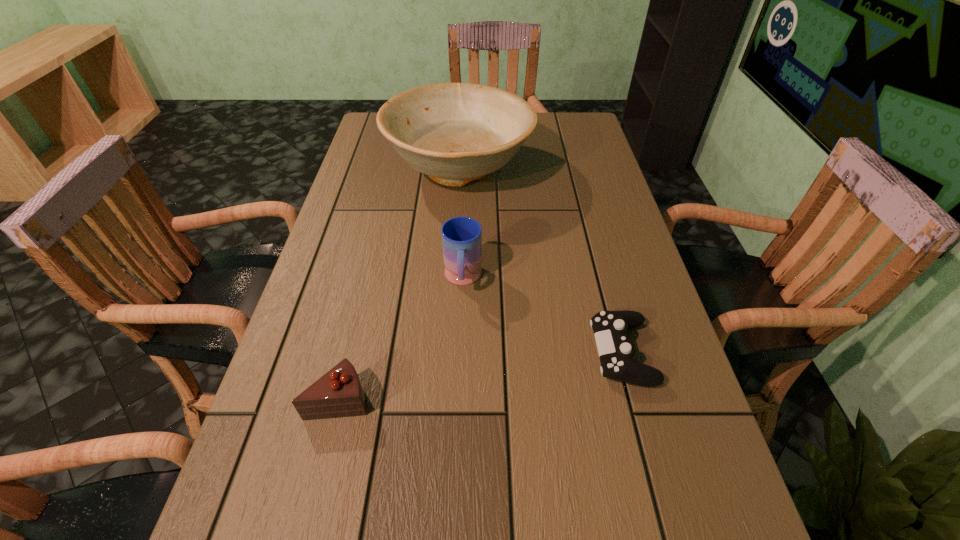
This screenshot has height=540, width=960. Identify the location of free space located 0.220m on the back of the taller chocolate cake. (365, 292).

What are the coordinates of `vacant area located 0.320m on the surface of the second shortest object` in the screenshot? It's located at (432, 353).

Find the location of a particular element. This screenshot has width=960, height=540. free space located on the surface of the second shortest object is located at coordinates (468, 353).

Locate an element on the screen. vacant space located on the surface of the second shortest object is located at coordinates (447, 353).

What are the coordinates of `object located at the far edge` in the screenshot? It's located at (455, 133).

Find the location of a particular element. dish located in the left edge section of the desktop is located at coordinates (455, 133).

What are the coordinates of `chocolate cake at the left edge` in the screenshot? It's located at (338, 393).

At what (x,y) coordinates should I click in order to perform the action: click on object present at the right edge. Please return your answer as a coordinate pair (x, y). Looking at the image, I should click on (610, 328).

You are a GUI agent. You are given a task and a screenshot of the screen. Output one action in this format:
    pyautogui.click(x=<x>, y=<y>)
    Task: Click on the object situated at the far left corner
    Image resolution: width=960 pixels, height=540 pixels.
    Given the screenshot: What is the action you would take?
    pyautogui.click(x=455, y=133)

Identify the location of vacant space at the left edge of the desktop. The height and width of the screenshot is (540, 960). (320, 319).